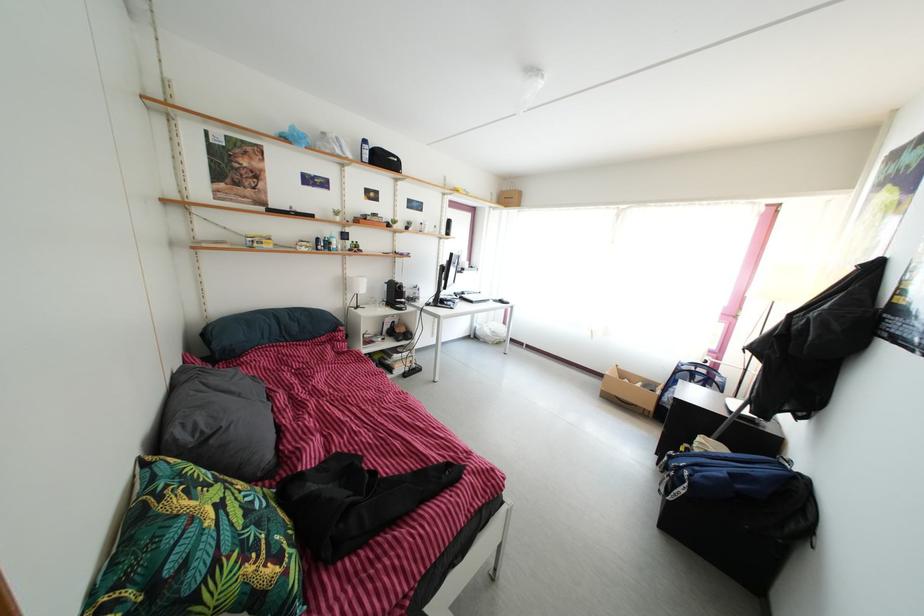
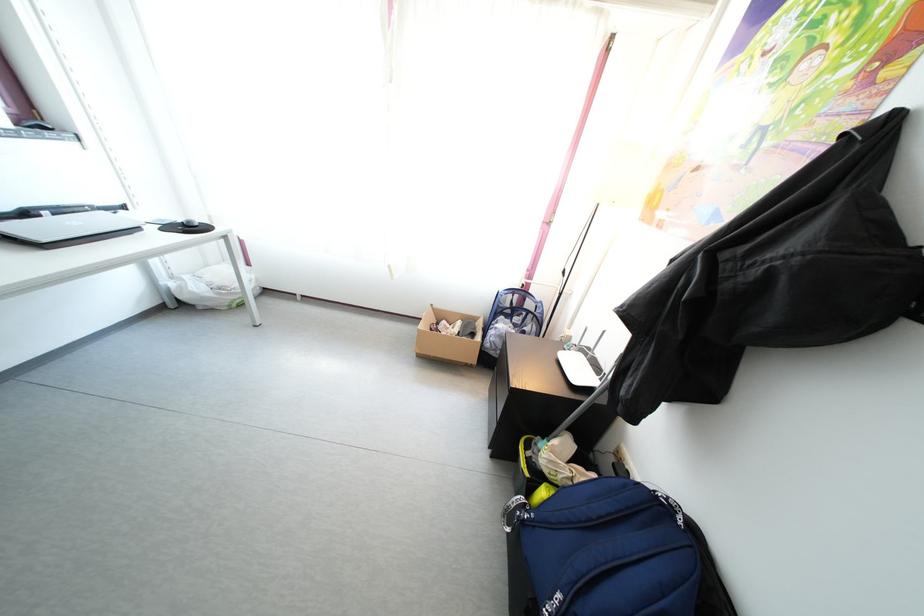
Find the pixel in the second image that matches (x=469, y=301) in the first image.

(31, 222)